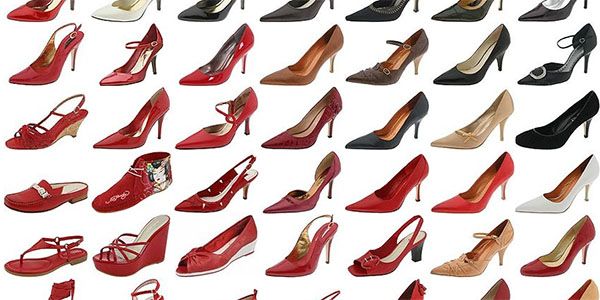
At what (x,y) coordinates should I click in order to perform the action: click on the 5th row of shoes in image. Please return your answer as a coordinate pair (x, y). Looking at the image, I should click on 46,261, 106,258, 193,261, 282,263, 359,261, 444,265, 535,270.